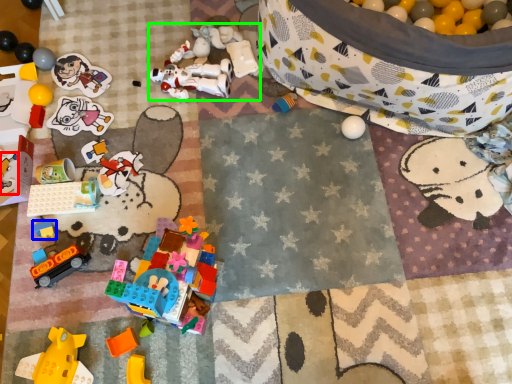
Question: Based on their relative distances, which object is nearer to toy (highlighted by a red box)? Choose from toy (highlighted by a blue box) and toy (highlighted by a green box).

Choices:
 (A) toy
 (B) toy

Answer: (A)